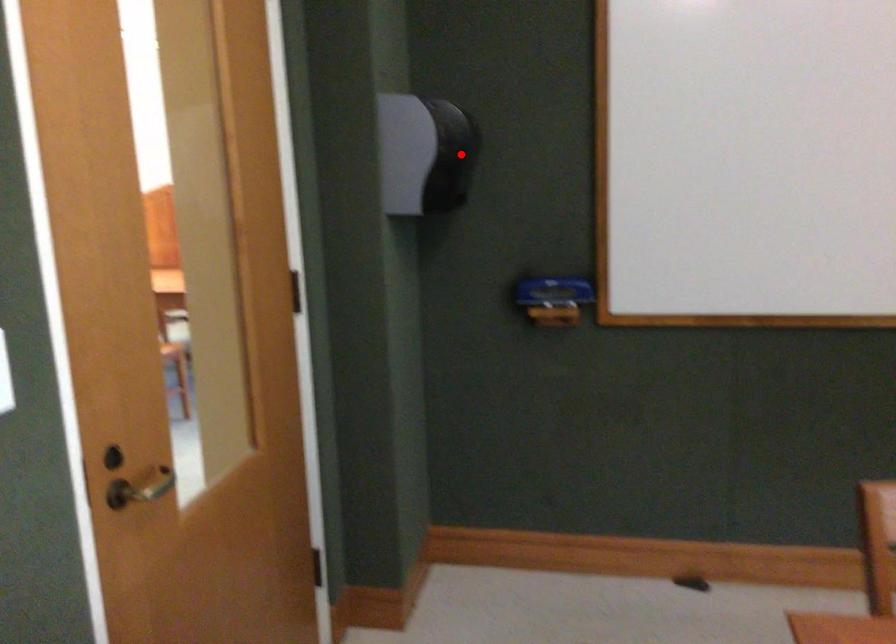
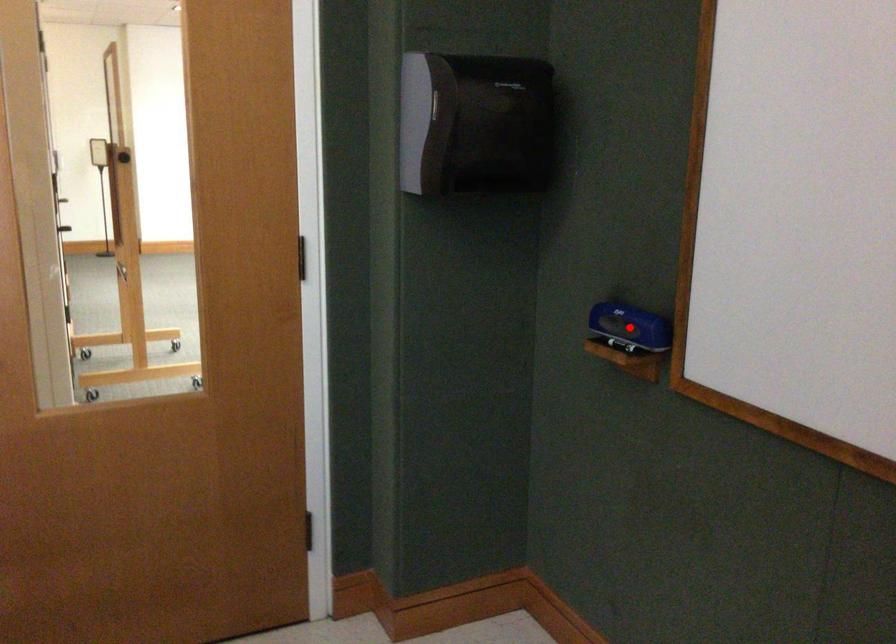
I am providing you with two images of the same scene from different viewpoints. A red point is marked on the first image and another point is marked on the second image. Do the highlighted points in image1 and image2 indicate the same real-world spot?

No